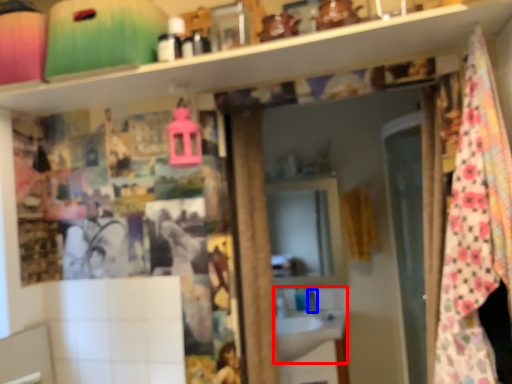
Question: Which object is further to the camera taking this photo, sink (highlighted by a red box) or faucet (highlighted by a blue box)?

Choices:
 (A) sink
 (B) faucet

Answer: (B)